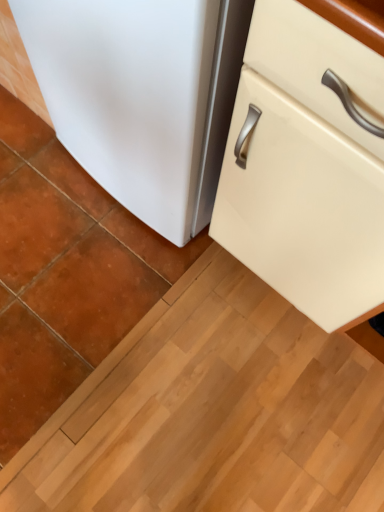
What is the approximate width of matte cream cabinet at lower right?

matte cream cabinet at lower right is 24.09 inches wide.

What are the coordinates of `matte cream cabinet at lower right` in the screenshot? It's located at (307, 166).

In order to face matte cream cabinet at lower right, should I rotate leftwards or rightwards?

Turn right approximately 29.157 degrees to face it.

This screenshot has width=384, height=512. What do you see at coordinates (307, 166) in the screenshot?
I see `matte cream cabinet at lower right` at bounding box center [307, 166].

Describe the element at coordinates (142, 96) in the screenshot. This screenshot has height=512, width=384. I see `white matte refrigerator at lower left` at that location.

Measure the distance between white matte refrigerator at lower left and camera.

white matte refrigerator at lower left and camera are 20.27 inches apart from each other.

You are a GUI agent. You are given a task and a screenshot of the screen. Output one action in this format:
    pyautogui.click(x=<x>, y=<y>)
    Task: Click on the white matte refrigerator at lower left
    
    Given the screenshot: What is the action you would take?
    pyautogui.click(x=142, y=96)

Locate an element on the screen. The width and height of the screenshot is (384, 512). matte cream cabinet at lower right is located at coordinates (307, 166).

Which object is positioned more to the right, matte cream cabinet at lower right or white matte refrigerator at lower left?

From the viewer's perspective, matte cream cabinet at lower right appears more on the right side.

Does matte cream cabinet at lower right come behind white matte refrigerator at lower left?

No.

Does point (251, 269) appear closer or farther from the camera than point (218, 160)?

Point (251, 269) appears to be farther away from the viewer than point (218, 160).

From the image's perspective, is matte cream cabinet at lower right located above or below white matte refrigerator at lower left?

From the image's perspective, matte cream cabinet at lower right appears below white matte refrigerator at lower left.

From a real-world perspective, is matte cream cabinet at lower right below white matte refrigerator at lower left?

Actually, matte cream cabinet at lower right is physically above white matte refrigerator at lower left in the real world.

Considering the relative sizes of matte cream cabinet at lower right and white matte refrigerator at lower left in the image provided, is matte cream cabinet at lower right wider than white matte refrigerator at lower left?

Correct, the width of matte cream cabinet at lower right exceeds that of white matte refrigerator at lower left.

Is matte cream cabinet at lower right shorter than white matte refrigerator at lower left?

No.

Between matte cream cabinet at lower right and white matte refrigerator at lower left, which one has larger size?

matte cream cabinet at lower right.

Is matte cream cabinet at lower right situated inside white matte refrigerator at lower left or outside?

matte cream cabinet at lower right is located beyond the bounds of white matte refrigerator at lower left.

Looking at this image, is matte cream cabinet at lower right touching white matte refrigerator at lower left?

There is a gap between matte cream cabinet at lower right and white matte refrigerator at lower left.

Could you tell me if matte cream cabinet at lower right is turned towards white matte refrigerator at lower left?

No.

How different are the orientations of matte cream cabinet at lower right and white matte refrigerator at lower left in degrees?

matte cream cabinet at lower right and white matte refrigerator at lower left are facing 1.79 degrees away from each other.

Locate an element on the screen. Image resolution: width=384 pixels, height=512 pixels. refrigerator behind the matte cream cabinet at lower right is located at coordinates (142, 96).

Considering the relative positions of white matte refrigerator at lower left and matte cream cabinet at lower right in the image provided, is white matte refrigerator at lower left to the left of matte cream cabinet at lower right from the viewer's perspective?

Correct, you'll find white matte refrigerator at lower left to the left of matte cream cabinet at lower right.

Is white matte refrigerator at lower left positioned before matte cream cabinet at lower right?

No, the depth of white matte refrigerator at lower left is greater than that of matte cream cabinet at lower right.

Which is less distant, (105, 5) or (241, 118)?

Clearly, point (105, 5) is closer to the camera than point (241, 118).

From the picture: From the image's perspective, between white matte refrigerator at lower left and matte cream cabinet at lower right, who is located below?

matte cream cabinet at lower right appears lower in the image.

From a real-world perspective, which is physically below, white matte refrigerator at lower left or matte cream cabinet at lower right?

white matte refrigerator at lower left is physically lower.

Consider the image. Can you confirm if white matte refrigerator at lower left is thinner than matte cream cabinet at lower right?

Correct, the width of white matte refrigerator at lower left is less than that of matte cream cabinet at lower right.

Which of these two, white matte refrigerator at lower left or matte cream cabinet at lower right, stands shorter?

With less height is white matte refrigerator at lower left.

Between white matte refrigerator at lower left and matte cream cabinet at lower right, which one has larger size?

With larger size is matte cream cabinet at lower right.

Is white matte refrigerator at lower left spatially inside matte cream cabinet at lower right, or outside of it?

white matte refrigerator at lower left is located beyond the bounds of matte cream cabinet at lower right.

Does white matte refrigerator at lower left touch matte cream cabinet at lower right?

No, white matte refrigerator at lower left is not with matte cream cabinet at lower right.

Is white matte refrigerator at lower left oriented away from matte cream cabinet at lower right?

No, white matte refrigerator at lower left is not facing away from matte cream cabinet at lower right.

Can you tell me how much white matte refrigerator at lower left and matte cream cabinet at lower right differ in facing direction?

There is a 1.79-degree angle between the facing directions of white matte refrigerator at lower left and matte cream cabinet at lower right.

Measure the distance from white matte refrigerator at lower left to matte cream cabinet at lower right.

white matte refrigerator at lower left and matte cream cabinet at lower right are 8.70 inches apart.

At what (x,y) coordinates should I click in order to perform the action: click on refrigerator that is under the matte cream cabinet at lower right (from a real-world perspective). Please return your answer as a coordinate pair (x, y). Looking at the image, I should click on (142, 96).

I want to click on refrigerator above the matte cream cabinet at lower right (from the image's perspective), so click(x=142, y=96).

This screenshot has width=384, height=512. In order to click on cabinetry in front of the white matte refrigerator at lower left in this screenshot , I will do coord(307,166).